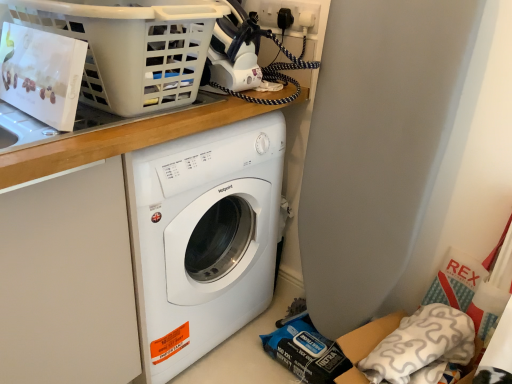
Question: Can you confirm if white soft pillow at lower right is wider than wooden at upper center?

Choices:
 (A) no
 (B) yes

Answer: (A)

Question: From the image's perspective, is white soft pillow at lower right above wooden at upper center?

Choices:
 (A) no
 (B) yes

Answer: (A)

Question: Can you confirm if white soft pillow at lower right is positioned to the right of wooden at upper center?

Choices:
 (A) yes
 (B) no

Answer: (A)

Question: Is the depth of white soft pillow at lower right greater than that of wooden at upper center?

Choices:
 (A) no
 (B) yes

Answer: (B)

Question: Is wooden at upper center completely or partially inside white soft pillow at lower right?

Choices:
 (A) yes
 (B) no

Answer: (B)

Question: Is point (453, 331) closer or farther from the camera than point (302, 8)?

Choices:
 (A) closer
 (B) farther

Answer: (A)

Question: From their relative heights in the image, would you say white soft pillow at lower right is taller or shorter than black plastic plug at upper right?

Choices:
 (A) tall
 (B) short

Answer: (A)

Question: Is white soft pillow at lower right wider or thinner than black plastic plug at upper right?

Choices:
 (A) thin
 (B) wide

Answer: (B)

Question: Relative to black plastic plug at upper right, is white soft pillow at lower right in front or behind?

Choices:
 (A) front
 (B) behind

Answer: (A)

Question: Is white soft pillow at lower right to the left or to the right of wooden at upper center in the image?

Choices:
 (A) right
 (B) left

Answer: (A)

Question: Considering their positions, is white soft pillow at lower right located in front of or behind wooden at upper center?

Choices:
 (A) behind
 (B) front

Answer: (A)

Question: From their relative heights in the image, would you say white soft pillow at lower right is taller or shorter than wooden at upper center?

Choices:
 (A) short
 (B) tall

Answer: (A)

Question: Is white soft pillow at lower right inside or outside of wooden at upper center?

Choices:
 (A) inside
 (B) outside

Answer: (B)

Question: Considering their positions, is wooden at upper center located in front of or behind white plastic basket at upper left?

Choices:
 (A) behind
 (B) front

Answer: (A)

Question: From a real-world perspective, is wooden at upper center positioned above or below white plastic basket at upper left?

Choices:
 (A) below
 (B) above

Answer: (A)